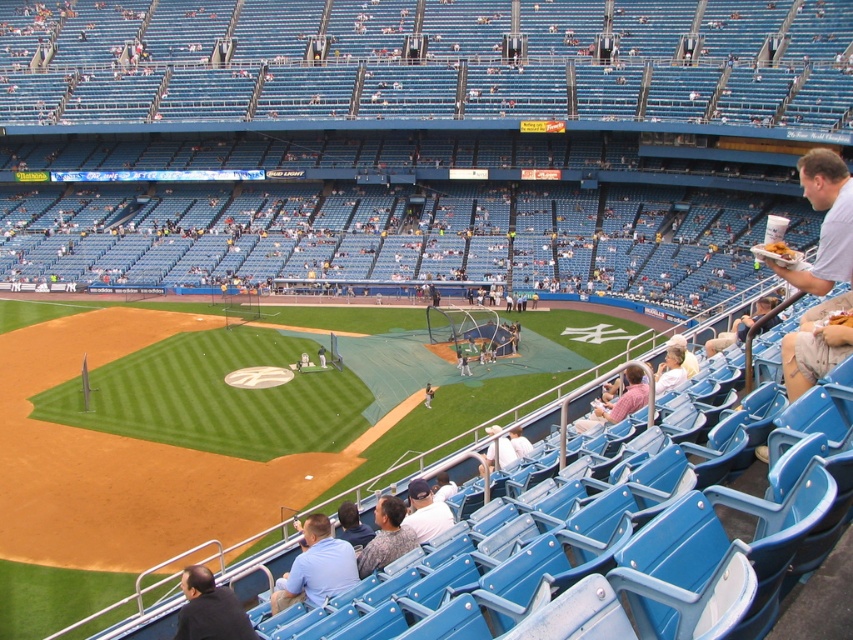
Question: Does blue fabric shirt at lower center appear over camouflage shirt at lower center?

Choices:
 (A) no
 (B) yes

Answer: (A)

Question: Which point is closer to the camera?

Choices:
 (A) tan leather glove at center
 (B) camouflage shirt at lower center

Answer: (B)

Question: Estimate the real-world distances between objects in this image. Which object is closer to the blue fabric shirt at lower center?

Choices:
 (A) light blue shirt at lower center
 (B) camouflage shirt at lower center
 (C) tan leather glove at center

Answer: (B)

Question: Can you confirm if blue fabric shirt at lower center is thinner than tan leather glove at center?

Choices:
 (A) no
 (B) yes

Answer: (A)

Question: Is light blue shirt at lower center positioned before tan leather glove at center?

Choices:
 (A) yes
 (B) no

Answer: (A)

Question: Which point appears closest to the camera in this image?

Choices:
 (A) (430, 400)
 (B) (422, 515)
 (C) (248, 621)
 (D) (390, 493)

Answer: (C)